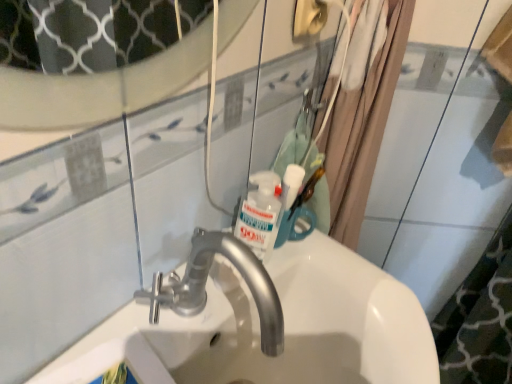
Question: Does beige fabric shower curtain at upper right appear on the left side of white glossy sink at center?

Choices:
 (A) yes
 (B) no

Answer: (B)

Question: Can you confirm if beige fabric shower curtain at upper right is thinner than white glossy sink at center?

Choices:
 (A) no
 (B) yes

Answer: (B)

Question: Does beige fabric shower curtain at upper right have a lesser height compared to white glossy sink at center?

Choices:
 (A) yes
 (B) no

Answer: (B)

Question: Does beige fabric shower curtain at upper right touch white glossy sink at center?

Choices:
 (A) yes
 (B) no

Answer: (B)

Question: Is beige fabric shower curtain at upper right closer to camera compared to white glossy sink at center?

Choices:
 (A) no
 (B) yes

Answer: (A)

Question: Does beige fabric shower curtain at upper right come behind white glossy sink at center?

Choices:
 (A) no
 (B) yes

Answer: (B)

Question: Is beige fabric shower curtain at upper right to the left of white glossy mouthwash at upper center from the viewer's perspective?

Choices:
 (A) no
 (B) yes

Answer: (A)

Question: From a real-world perspective, is beige fabric shower curtain at upper right below white glossy mouthwash at upper center?

Choices:
 (A) no
 (B) yes

Answer: (A)

Question: From the image's perspective, is beige fabric shower curtain at upper right on top of white glossy mouthwash at upper center?

Choices:
 (A) yes
 (B) no

Answer: (A)

Question: Does beige fabric shower curtain at upper right turn towards white glossy mouthwash at upper center?

Choices:
 (A) no
 (B) yes

Answer: (A)

Question: Is beige fabric shower curtain at upper right positioned before white glossy mouthwash at upper center?

Choices:
 (A) yes
 (B) no

Answer: (A)

Question: Is white glossy mouthwash at upper center at the back of beige fabric shower curtain at upper right?

Choices:
 (A) yes
 (B) no

Answer: (B)

Question: Considering the relative sizes of white glossy mouthwash at upper center and beige fabric shower curtain at upper right in the image provided, is white glossy mouthwash at upper center taller than beige fabric shower curtain at upper right?

Choices:
 (A) no
 (B) yes

Answer: (A)